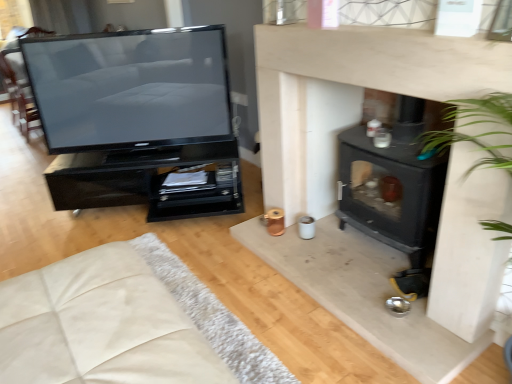
What is the approximate width of black glossy tv stand at left?

It is 24.62 inches.

In order to click on beige fabric couch at lower left in this screenshot , I will do `click(100, 325)`.

Is black matte wood burning stove at center-right shorter than beige fabric couch at lower left?

In fact, black matte wood burning stove at center-right may be taller than beige fabric couch at lower left.

Considering the positions of points (442, 160) and (65, 272), is point (442, 160) farther from camera compared to point (65, 272)?

That is True.

Is black matte wood burning stove at center-right positioned with its back to beige fabric couch at lower left?

No, black matte wood burning stove at center-right is not facing away from beige fabric couch at lower left.

Considering the positions of objects black matte wood burning stove at center-right and beige fabric couch at lower left in the image provided, who is behind, black matte wood burning stove at center-right or beige fabric couch at lower left?

Positioned behind is black matte wood burning stove at center-right.

Considering the positions of objects black glossy tv stand at left and black matte wood burning stove at center-right in the image provided, who is behind, black glossy tv stand at left or black matte wood burning stove at center-right?

black glossy tv stand at left is more distant.

Can we say black glossy tv stand at left lies outside black matte wood burning stove at center-right?

Absolutely, black glossy tv stand at left is external to black matte wood burning stove at center-right.

Considering the positions of objects black glossy tv stand at left and black matte wood burning stove at center-right in the image provided, who is more to the left, black glossy tv stand at left or black matte wood burning stove at center-right?

black glossy tv stand at left.

Is black glossy tv stand at left taller than black matte wood burning stove at center-right?

In fact, black glossy tv stand at left may be shorter than black matte wood burning stove at center-right.

At what (x,y) coordinates should I click in order to perform the action: click on furniture below the matte black television at left (from the image's perspective). Please return your answer as a coordinate pair (x, y). Image resolution: width=512 pixels, height=384 pixels. Looking at the image, I should click on (148, 181).

From a real-world perspective, is matte black television at left positioned over black glossy tv stand at left based on gravity?

Yes, from a real-world perspective, matte black television at left is over black glossy tv stand at left

Is matte black television at left beside black glossy tv stand at left?

matte black television at left and black glossy tv stand at left are clearly separated.

In terms of size, does matte black television at left appear bigger or smaller than black glossy tv stand at left?

Considering their sizes, matte black television at left takes up less space than black glossy tv stand at left.

Identify the location of wood burning stove behind the beige fabric couch at lower left. (394, 192).

Considering the relative sizes of beige fabric couch at lower left and black matte wood burning stove at center-right in the image provided, is beige fabric couch at lower left bigger than black matte wood burning stove at center-right?

Indeed, beige fabric couch at lower left has a larger size compared to black matte wood burning stove at center-right.

Which is more to the right, beige fabric couch at lower left or black matte wood burning stove at center-right?

black matte wood burning stove at center-right is more to the right.

Is matte black television at left at the back of black glossy tv stand at left?

No, black glossy tv stand at left is not facing the opposite direction of matte black television at left.

Which of these two, black glossy tv stand at left or matte black television at left, is bigger?

Bigger between the two is black glossy tv stand at left.

Is matte black television at left completely or partially inside black glossy tv stand at left?

No, matte black television at left is not surrounded by black glossy tv stand at left.

Considering the positions of point (233, 203) and point (45, 72), is point (233, 203) closer or farther from the camera than point (45, 72)?

Point (233, 203).

The width and height of the screenshot is (512, 384). I want to click on television to the left of beige fabric couch at lower left, so click(x=131, y=88).

Could you tell me if beige fabric couch at lower left is facing matte black television at left?

No, beige fabric couch at lower left is not turned towards matte black television at left.

From the image's perspective, would you say beige fabric couch at lower left is positioned over matte black television at left?

No, from the image's perspective, beige fabric couch at lower left is not above matte black television at left.

Considering the relative positions of beige fabric couch at lower left and matte black television at left in the image provided, is beige fabric couch at lower left to the left or to the right of matte black television at left?

In the image, beige fabric couch at lower left appears on the right side of matte black television at left.

Who is smaller, black matte wood burning stove at center-right or black glossy tv stand at left?

Smaller between the two is black matte wood burning stove at center-right.

Where is `furniture that appears below the black matte wood burning stove at center-right (from a real-world perspective)`? furniture that appears below the black matte wood burning stove at center-right (from a real-world perspective) is located at coordinates (148, 181).

Is black matte wood burning stove at center-right shorter than black glossy tv stand at left?

No, black matte wood burning stove at center-right is not shorter than black glossy tv stand at left.

Is point (422, 179) closer or farther from the camera than point (207, 215)?

Point (422, 179) is closer to the camera than point (207, 215).

The width and height of the screenshot is (512, 384). I want to click on wood burning stove lying above the beige fabric couch at lower left (from the image's perspective), so click(394, 192).

This screenshot has width=512, height=384. I want to click on wood burning stove in front of the black glossy tv stand at left, so click(394, 192).

Considering their positions, is beige fabric couch at lower left positioned further to black matte wood burning stove at center-right than matte black television at left?

Based on the image, matte black television at left appears to be further to black matte wood burning stove at center-right.

When comparing their distances from beige fabric couch at lower left, does matte black television at left or black glossy tv stand at left seem further?

matte black television at left is positioned further to the anchor beige fabric couch at lower left.

When comparing their distances from black glossy tv stand at left, does black matte wood burning stove at center-right or matte black television at left seem closer?

matte black television at left is closer to black glossy tv stand at left.

Considering their positions, is beige fabric couch at lower left positioned closer to black glossy tv stand at left than matte black television at left?

The object closer to black glossy tv stand at left is matte black television at left.

Looking at the image, which one is located further to matte black television at left, black matte wood burning stove at center-right or black glossy tv stand at left?

black matte wood burning stove at center-right.

Which object lies nearer to the anchor point black matte wood burning stove at center-right, matte black television at left or black glossy tv stand at left?

black glossy tv stand at left.

Looking at this image, from the image, which object appears to be nearer to beige fabric couch at lower left, black glossy tv stand at left or black matte wood burning stove at center-right?

black matte wood burning stove at center-right.

Considering their positions, is black glossy tv stand at left positioned closer to beige fabric couch at lower left than matte black television at left?

black glossy tv stand at left.

I want to click on furniture between matte black television at left and black matte wood burning stove at center-right in the horizontal direction, so click(148, 181).

Locate an element on the screen. The image size is (512, 384). wood burning stove located between beige fabric couch at lower left and matte black television at left in the depth direction is located at coordinates (394, 192).

Locate an element on the screen. This screenshot has width=512, height=384. television between beige fabric couch at lower left and black glossy tv stand at left in the front-back direction is located at coordinates (131, 88).

Identify the location of wood burning stove between beige fabric couch at lower left and black glossy tv stand at left from front to back. This screenshot has width=512, height=384. (394, 192).